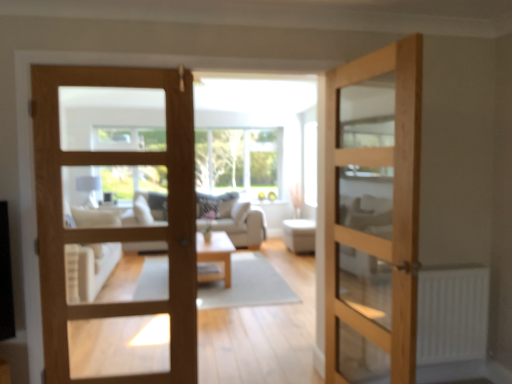
Question: Does light wood/texture coffee table at center have a smaller size compared to white matte radiator at lower right?

Choices:
 (A) yes
 (B) no

Answer: (B)

Question: Considering the relative sizes of light wood/texture coffee table at center and white matte radiator at lower right in the image provided, is light wood/texture coffee table at center shorter than white matte radiator at lower right?

Choices:
 (A) no
 (B) yes

Answer: (B)

Question: Is there a large distance between light wood/texture coffee table at center and white matte radiator at lower right?

Choices:
 (A) no
 (B) yes

Answer: (B)

Question: Is light wood/texture coffee table at center directly adjacent to white matte radiator at lower right?

Choices:
 (A) yes
 (B) no

Answer: (B)

Question: Is light wood/texture coffee table at center facing towards white matte radiator at lower right?

Choices:
 (A) no
 (B) yes

Answer: (A)

Question: In terms of size, does white fabric ottoman at center appear bigger or smaller than light wood/texture coffee table at center?

Choices:
 (A) small
 (B) big

Answer: (A)

Question: Considering the positions of white fabric ottoman at center and light wood/texture coffee table at center in the image, is white fabric ottoman at center wider or thinner than light wood/texture coffee table at center?

Choices:
 (A) thin
 (B) wide

Answer: (A)

Question: From a real-world perspective, is white fabric ottoman at center positioned above or below light wood/texture coffee table at center?

Choices:
 (A) below
 (B) above

Answer: (B)

Question: Do you think white fabric ottoman at center is within light wood/texture coffee table at center, or outside of it?

Choices:
 (A) inside
 (B) outside

Answer: (B)

Question: In the image, is white fabric ottoman at center on the left side or the right side of clear glass window at center?

Choices:
 (A) right
 (B) left

Answer: (A)

Question: From a real-world perspective, is white fabric ottoman at center positioned above or below clear glass window at center?

Choices:
 (A) below
 (B) above

Answer: (A)

Question: Is white fabric ottoman at center wider or thinner than clear glass window at center?

Choices:
 (A) thin
 (B) wide

Answer: (B)

Question: Relative to clear glass window at center, is white fabric ottoman at center in front or behind?

Choices:
 (A) front
 (B) behind

Answer: (A)

Question: Do you think white fabric ottoman at center is within natural wood door at center, the first door in the right-to-left sequence, or outside of it?

Choices:
 (A) outside
 (B) inside

Answer: (A)

Question: In the image, is white fabric ottoman at center on the left side or the right side of natural wood door at center, which is the second door from left to right?

Choices:
 (A) right
 (B) left

Answer: (A)